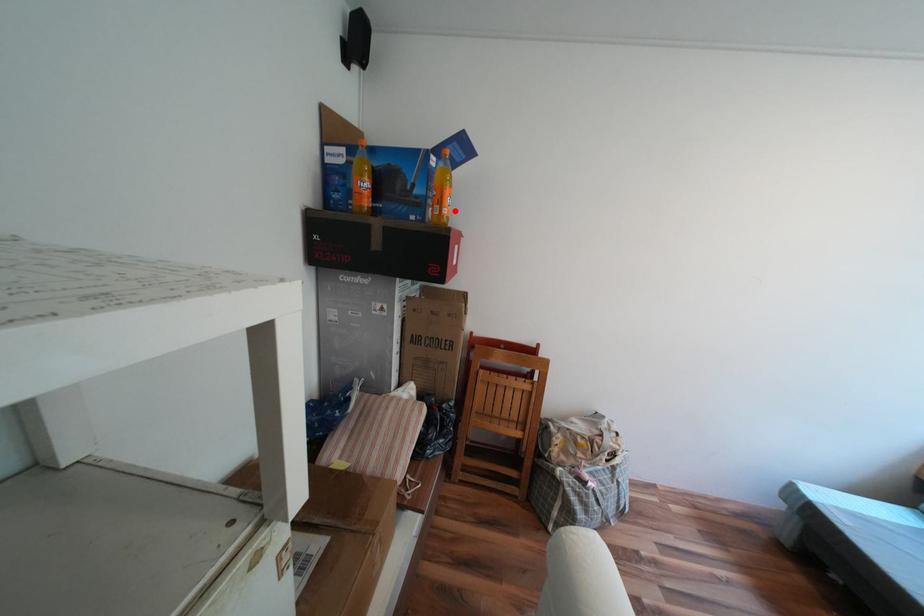
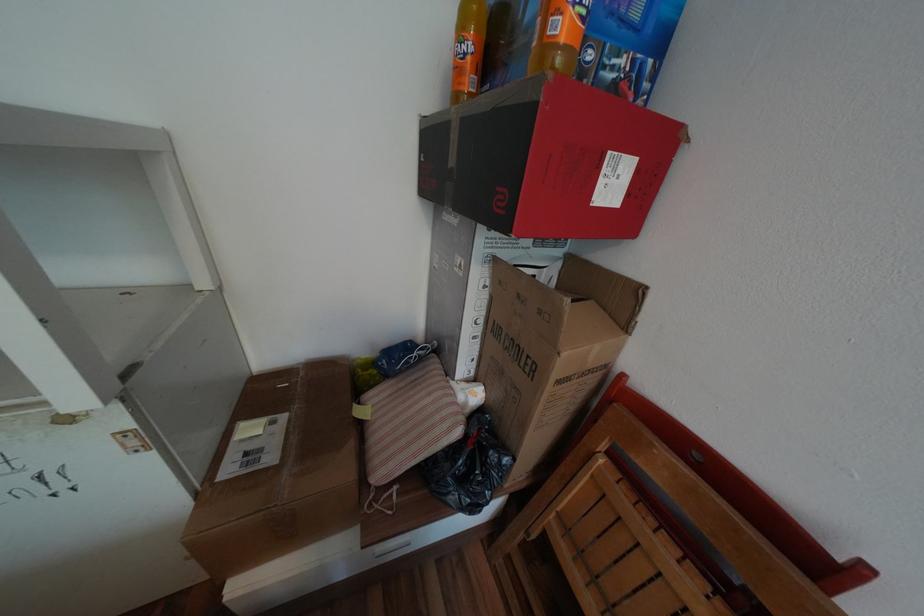
In the second image, find the point that corresponds to the highlighted location in the first image.

(569, 26)